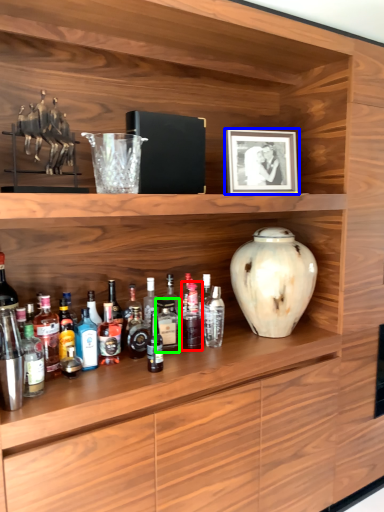
Question: Which object is positioned closest to bottle (highlighted by a red box)? Select from picture frame (highlighted by a blue box) and bottle (highlighted by a green box).

Choices:
 (A) picture frame
 (B) bottle

Answer: (B)